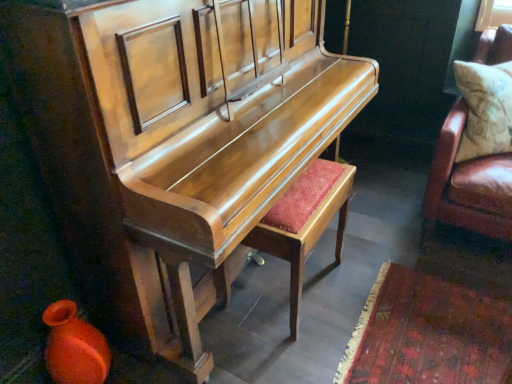
Question: From the image's perspective, is leather cushion at right, placed as the first furniture when sorted from right to left, above or below shiny wood piano at center, which ranks as the first furniture in left-to-right order?

Choices:
 (A) above
 (B) below

Answer: (A)

Question: Considering their positions, is leather cushion at right, placed as the first furniture when sorted from right to left, located in front of or behind shiny wood piano at center, the 2th furniture when ordered from right to left?

Choices:
 (A) front
 (B) behind

Answer: (B)

Question: Which is nearer to the matte orange vase at lower left?

Choices:
 (A) leather cushion at right, placed as the first furniture when sorted from right to left
 (B) matte wood stool at center
 (C) shiny wood piano at center, which ranks as the first furniture in left-to-right order

Answer: (C)

Question: Which of these objects is positioned closest to the matte orange vase at lower left?

Choices:
 (A) shiny wood piano at center, which ranks as the first furniture in left-to-right order
 (B) leather cushion at right, positioned as the 2th furniture in left-to-right order
 (C) matte wood stool at center

Answer: (A)